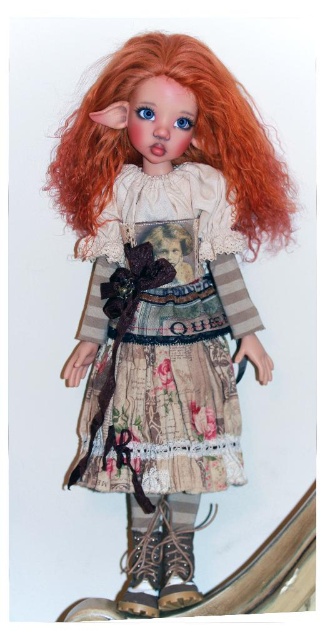
The width and height of the screenshot is (325, 640). What do you see at coordinates (164, 339) in the screenshot?
I see `textured beige dress at center` at bounding box center [164, 339].

Does textured beige dress at center appear on the right side of vivid orange hair at center?

In fact, textured beige dress at center is to the left of vivid orange hair at center.

Is point (127, 355) farther from camera compared to point (64, 132)?

Yes, it is behind point (64, 132).

Image resolution: width=325 pixels, height=640 pixels. I want to click on textured beige dress at center, so click(x=164, y=339).

Can you confirm if matte cream fabric dress at center is smaller than leather boot at lower center?

Incorrect, matte cream fabric dress at center is not smaller in size than leather boot at lower center.

Between point (246, 209) and point (137, 556), which one is positioned in front?

Positioned in front is point (137, 556).

Is point (210, 465) more distant than point (152, 592)?

Yes, point (210, 465) is farther from viewer.

The height and width of the screenshot is (640, 325). I want to click on matte cream fabric dress at center, so click(166, 280).

Does matte cream fabric dress at center have a smaller size compared to vivid orange hair at center?

Actually, matte cream fabric dress at center might be larger than vivid orange hair at center.

Who is positioned more to the left, matte cream fabric dress at center or vivid orange hair at center?

matte cream fabric dress at center

Does point (218, 428) come farther from viewer compared to point (128, 49)?

That is True.

Identify the location of matte cream fabric dress at center. This screenshot has width=325, height=640. (166, 280).